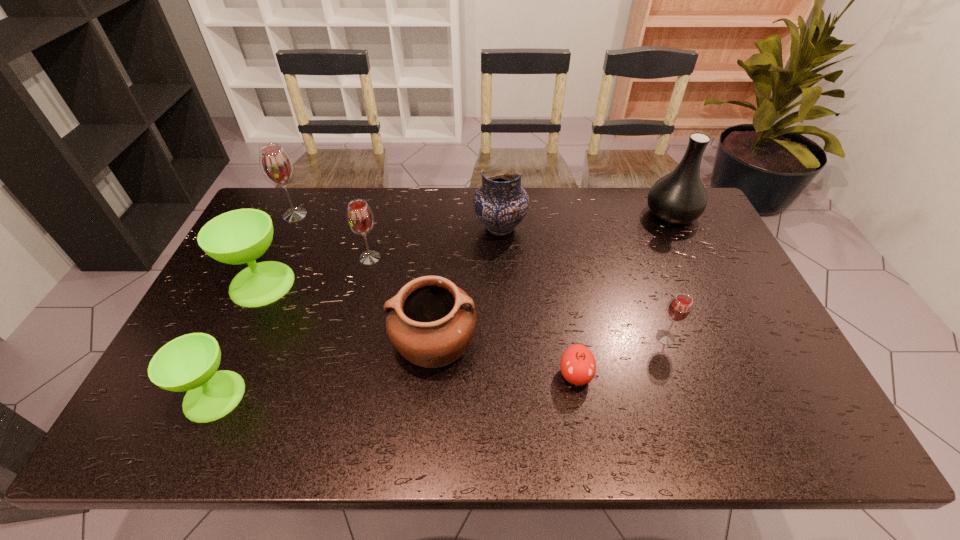
You are a GUI agent. You are given a task and a screenshot of the screen. Output one action in this format:
    pyautogui.click(x=<x>, y=<y>)
    Task: Click on the fourth farthest wineglass
    The height and width of the screenshot is (540, 960).
    Given the screenshot: What is the action you would take?
    pyautogui.click(x=679, y=309)

Locate an element on the screen. This screenshot has height=540, width=960. the rightmost wineglass is located at coordinates 679,309.

This screenshot has width=960, height=540. Find the location of `the nearest wineglass`. the nearest wineglass is located at coordinates (189, 363).

Locate an element on the screen. Image resolution: width=960 pixels, height=540 pixels. the nearer green wineglass is located at coordinates (189, 363).

The height and width of the screenshot is (540, 960). Identify the location of the third object from right to left. (578, 366).

You are a GUI agent. You are given a task and a screenshot of the screen. Output one action in this format:
    pyautogui.click(x=<x>, y=<y>)
    Task: Click on the apple
    The image size is (960, 540).
    Given the screenshot: What is the action you would take?
    pyautogui.click(x=578, y=366)

What are the coordinates of `vacant region located 0.070m on the left of the rightmost object` in the screenshot? It's located at (624, 214).

Locate an element on the screen. The width and height of the screenshot is (960, 540). vacant space located 0.060m on the right of the tallest wineglass is located at coordinates (326, 215).

Find the location of a particular element. This screenshot has height=540, width=960. free location located 0.090m on the front of the blue pottery is located at coordinates (502, 265).

This screenshot has width=960, height=540. Find the location of `free space located 0.300m on the back of the second red wineglass from right to left`. free space located 0.300m on the back of the second red wineglass from right to left is located at coordinates (386, 194).